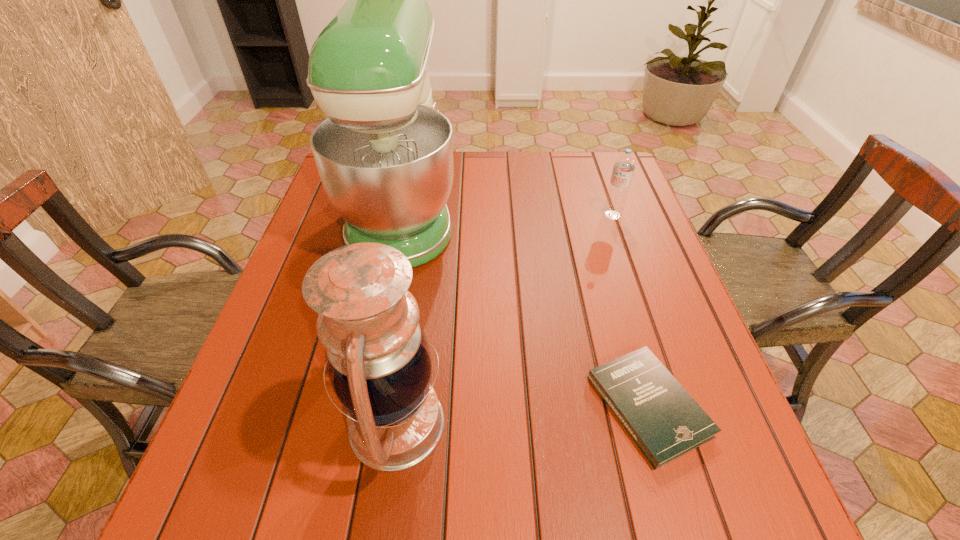
The image size is (960, 540). In order to click on the tallest object in this screenshot , I will do `click(384, 154)`.

I want to click on the third shortest object, so click(378, 360).

You are a GUI agent. You are given a task and a screenshot of the screen. Output one action in this format:
    pyautogui.click(x=<x>, y=<y>)
    Task: Click on the water bottle
    Image resolution: width=960 pixels, height=540 pixels.
    Given the screenshot: What is the action you would take?
    pyautogui.click(x=624, y=165)

Find the location of a particular element. Image resolution: width=960 pixels, height=540 pixels. book is located at coordinates (665, 422).

Image resolution: width=960 pixels, height=540 pixels. Identify the location of free region located 0.310m on the controls of the tallest object. (569, 211).

I want to click on free point located 0.140m on the back of the oil lamp, so click(412, 313).

What are the coordinates of `vacant point located 0.300m on the front of the water bottle` in the screenshot? It's located at (643, 303).

Where is `vacant area located on the back of the shortest object`? This screenshot has height=540, width=960. vacant area located on the back of the shortest object is located at coordinates (627, 334).

Where is `object situated at the far edge`? The width and height of the screenshot is (960, 540). object situated at the far edge is located at coordinates pyautogui.click(x=384, y=154).

The image size is (960, 540). Find the location of `object that is positioned at the near edge`. object that is positioned at the near edge is located at coordinates (378, 360).